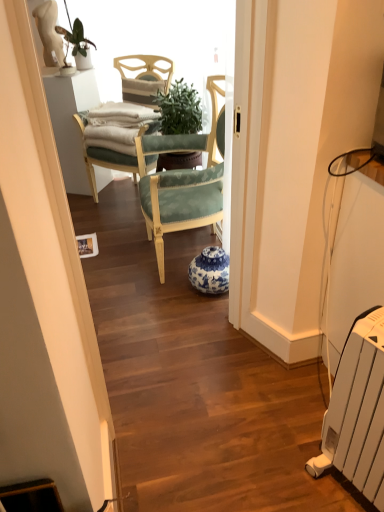
Question: Is green leafy plant at upper left located outside blue and white porcelain vase at center?

Choices:
 (A) yes
 (B) no

Answer: (A)

Question: Considering the relative sizes of green leafy plant at upper left and blue and white porcelain vase at center in the image provided, is green leafy plant at upper left shorter than blue and white porcelain vase at center?

Choices:
 (A) yes
 (B) no

Answer: (B)

Question: Is green leafy plant at upper left positioned with its back to blue and white porcelain vase at center?

Choices:
 (A) yes
 (B) no

Answer: (B)

Question: Does green leafy plant at upper left appear on the right side of blue and white porcelain vase at center?

Choices:
 (A) no
 (B) yes

Answer: (A)

Question: Can you confirm if green leafy plant at upper left is taller than blue and white porcelain vase at center?

Choices:
 (A) yes
 (B) no

Answer: (A)

Question: Is blue and white porcelain vase at center taller or shorter than green leafy plant at upper left?

Choices:
 (A) tall
 (B) short

Answer: (B)

Question: Would you say blue and white porcelain vase at center is inside or outside green leafy plant at upper left?

Choices:
 (A) inside
 (B) outside

Answer: (B)

Question: Considering the positions of point (226, 269) and point (77, 46), is point (226, 269) closer or farther from the camera than point (77, 46)?

Choices:
 (A) closer
 (B) farther

Answer: (A)

Question: Based on their sizes in the image, would you say blue and white porcelain vase at center is bigger or smaller than green leafy plant at upper left?

Choices:
 (A) small
 (B) big

Answer: (B)

Question: Does point click(x=61, y=27) appear closer or farther from the camera than point click(x=223, y=273)?

Choices:
 (A) farther
 (B) closer

Answer: (A)

Question: Is green leafy plant at upper left wider or thinner than blue and white porcelain vase at center?

Choices:
 (A) wide
 (B) thin

Answer: (B)

Question: In the image, is green leafy plant at upper left positioned in front of or behind blue and white porcelain vase at center?

Choices:
 (A) behind
 (B) front

Answer: (A)

Question: Is green leafy plant at upper left bigger or smaller than blue and white porcelain vase at center?

Choices:
 (A) small
 (B) big

Answer: (A)

Question: In terms of height, does green leafy plant at upper left look taller or shorter compared to white plastic radiator at lower right?

Choices:
 (A) tall
 (B) short

Answer: (B)

Question: From a real-world perspective, is green leafy plant at upper left physically located above or below white plastic radiator at lower right?

Choices:
 (A) below
 (B) above

Answer: (B)